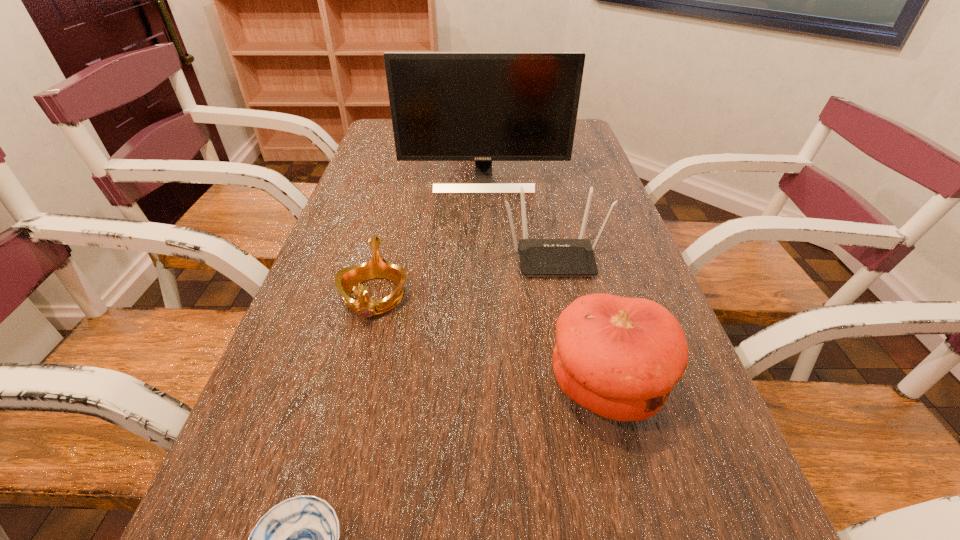
The width and height of the screenshot is (960, 540). Identify the location of the farthest object. (445, 106).

This screenshot has width=960, height=540. I want to click on the tallest object, so click(445, 106).

Identify the location of pumpkin. Image resolution: width=960 pixels, height=540 pixels. (619, 357).

Where is `the second nearest object`? the second nearest object is located at coordinates (619, 357).

Where is `the third shortest object`? The height and width of the screenshot is (540, 960). the third shortest object is located at coordinates (538, 257).

Locate an element on the screen. The image size is (960, 540). the fourth tallest object is located at coordinates (346, 280).

The height and width of the screenshot is (540, 960). I want to click on free region located on the screen side of the tallest object, so click(x=485, y=237).

Where is `vacant region located on the back of the fourth shortest object`? This screenshot has height=540, width=960. vacant region located on the back of the fourth shortest object is located at coordinates (574, 260).

At what (x,y) coordinates should I click in order to perform the action: click on vacant space located on the front-facing side of the third tallest object. Please return your answer as a coordinate pair (x, y). Looking at the image, I should click on (593, 446).

The width and height of the screenshot is (960, 540). I want to click on free spot located 0.230m at the front emblem of the tiara, so click(x=338, y=435).